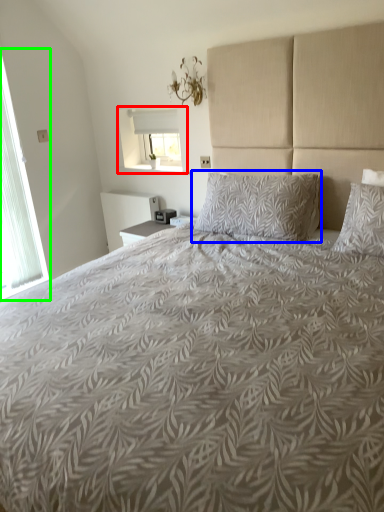
Question: Considering the real-world distances, which object is closest to window (highlighted by a red box)? pillow (highlighted by a blue box) or window (highlighted by a green box).

Choices:
 (A) pillow
 (B) window

Answer: (B)